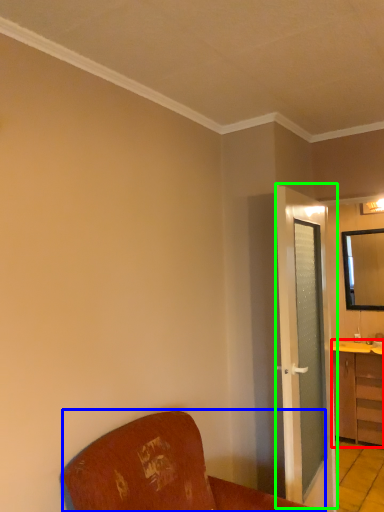
Question: Based on their relative distances, which object is nearer to cabinetry (highlighted by a red box)? Choose from furniture (highlighted by a blue box) and door (highlighted by a green box).

Choices:
 (A) furniture
 (B) door

Answer: (B)